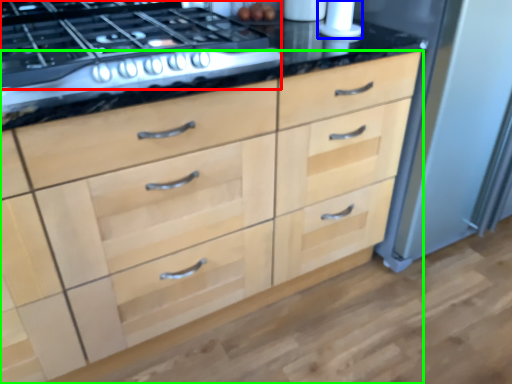
Question: Based on their relative distances, which object is farther from gas stove (highlighted by a red box)? Choose from appliance (highlighted by a blue box) and chest of drawers (highlighted by a green box).

Choices:
 (A) appliance
 (B) chest of drawers

Answer: (A)